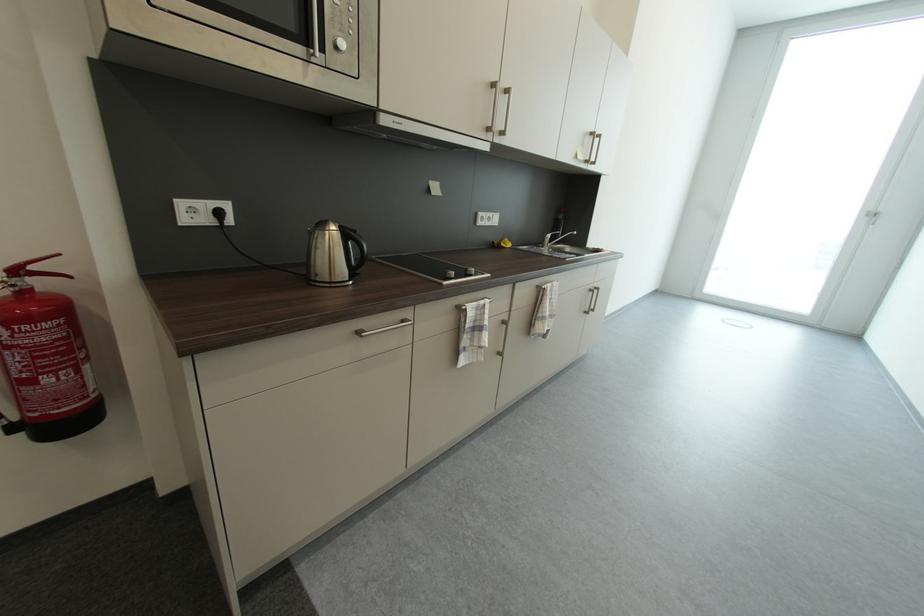
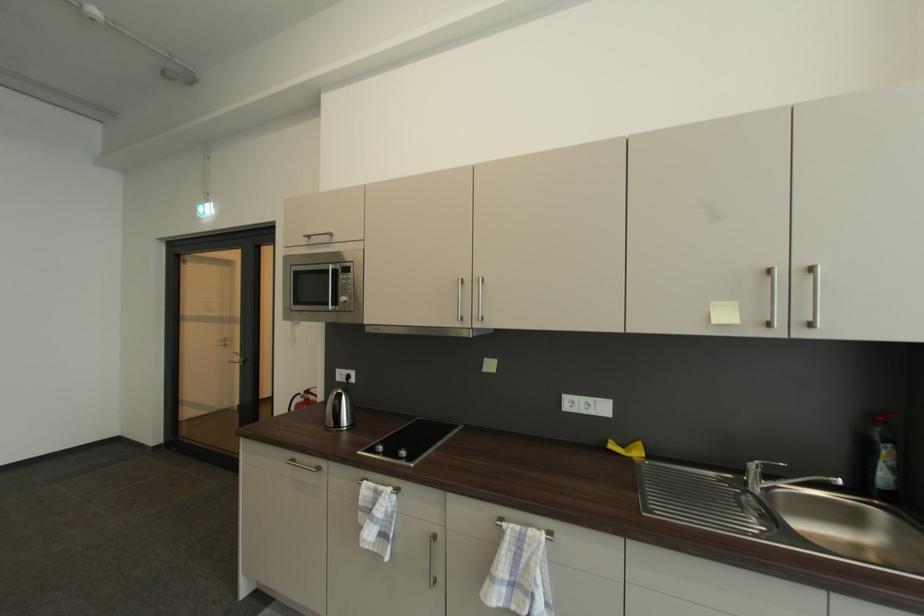
The point at (552, 290) is marked in the first image. Where is the corresponding point in the second image?

(507, 529)